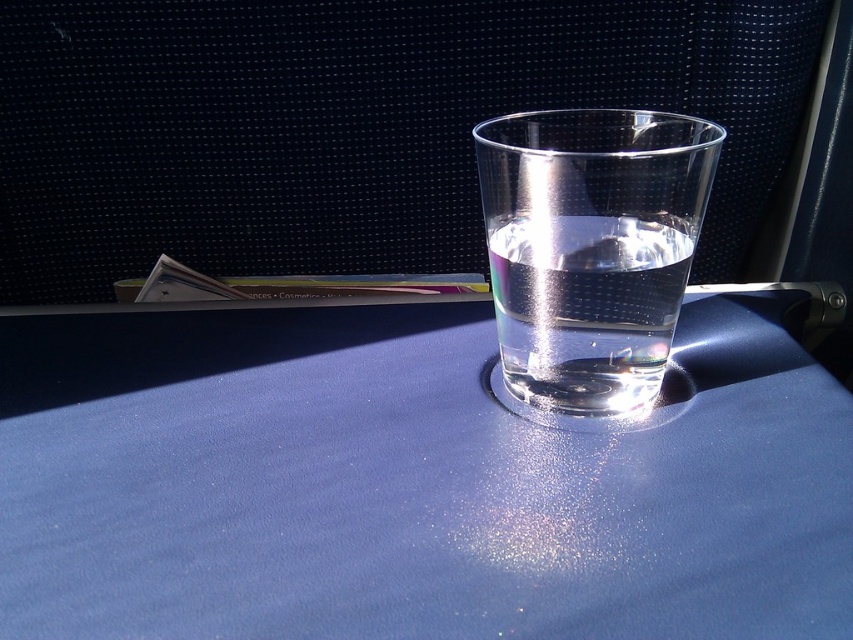
Measure the distance from blue matte table at center to transparent glass at center.

blue matte table at center is 8.00 centimeters from transparent glass at center.

Who is more distant from viewer, (432,634) or (556,280)?

The point (556,280) is behind.

The height and width of the screenshot is (640, 853). Find the location of `blue matte table at center`. blue matte table at center is located at coordinates (413, 477).